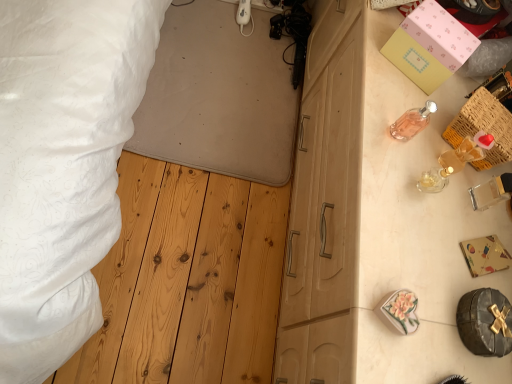
I want to click on vacant area on the back side of gold foil gift box at right, which ranks as the second box in top-to-bottom order, so click(x=483, y=200).